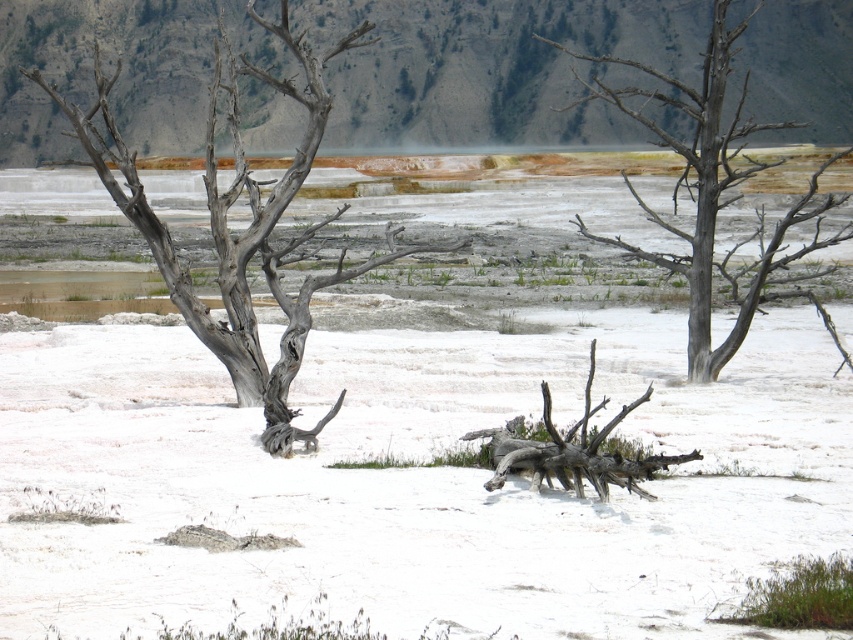
Consider the image. You are a geologist examining the stark landscape. You notice the gray rough bark tree at left and the gray bark tree at right. Which of these two trees has a larger size?

The gray rough bark tree at left is bigger than the gray bark tree at right.

You are a park ranger who needs to measure the distance between the two gray bark trees in the image. The minimum distance required between trees for a new trail is 40 feet. Based on the scene, can the trail be placed between the gray rough bark tree at left and the gray bark tree at right?

The gray rough bark tree at left and the gray bark tree at right are 42.65 feet apart from each other. Since the required minimum distance is 40 feet, the trail can be placed between them as the distance meets the requirement.